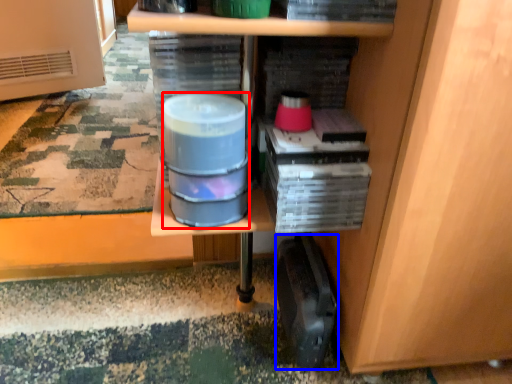
Question: Which point is closer to the camera, water (highlighted by a red box) or wide (highlighted by a blue box)?

Choices:
 (A) water
 (B) wide

Answer: (A)